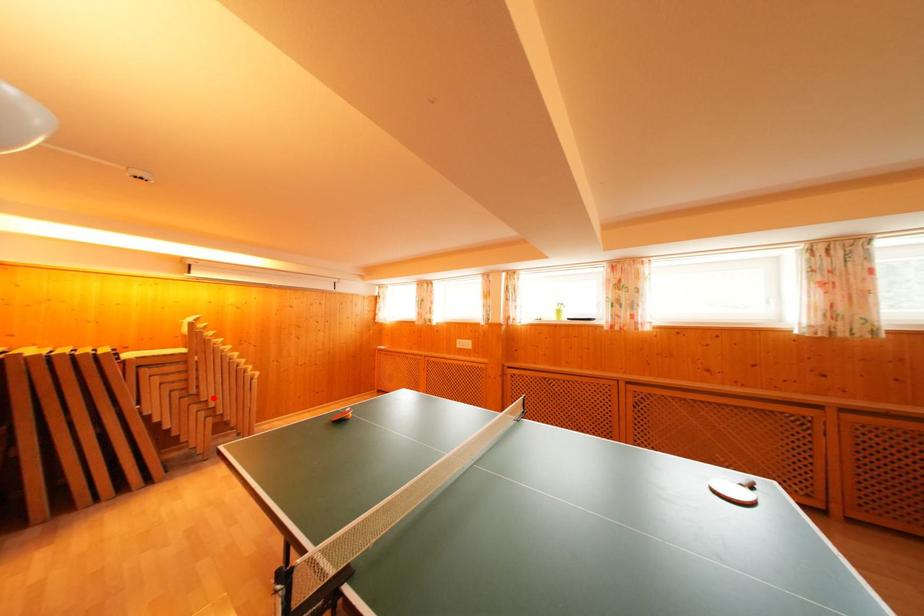
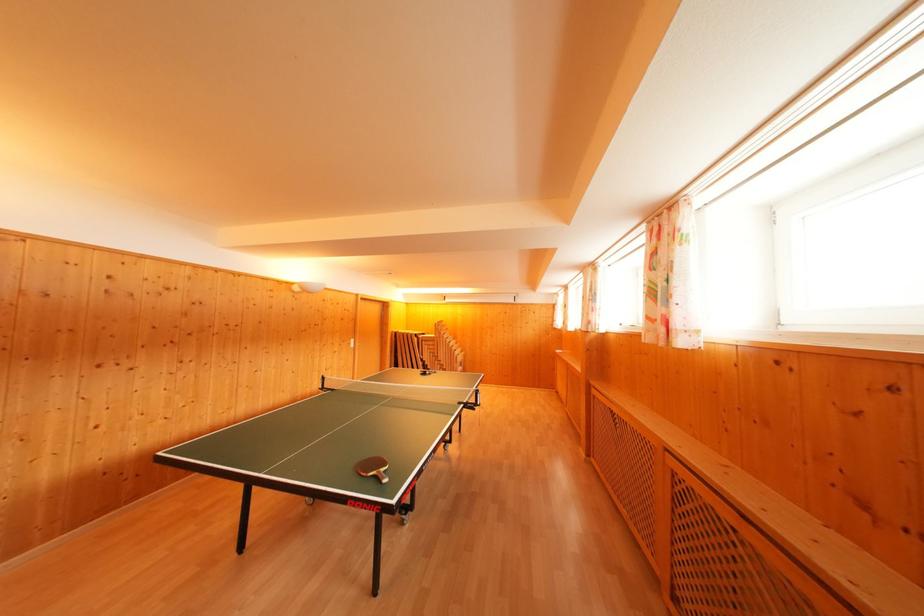
Question: I am providing you with two images of the same scene from different viewpoints. Image1 has a red point marked. In image2, the corresponding 3D location appears at what relative position? Reply with the corresponding letter.

Choices:
 (A) Closer
 (B) Farther

Answer: (B)